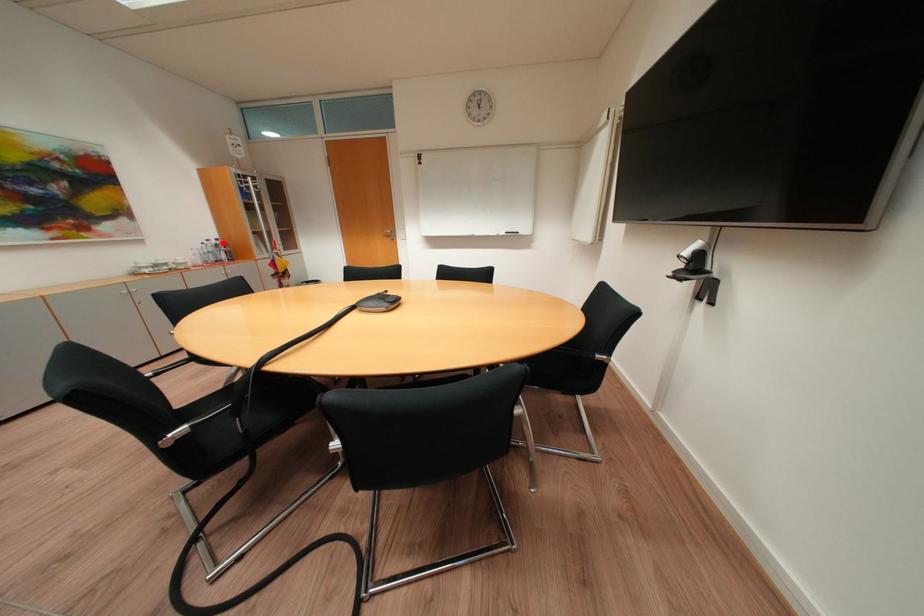
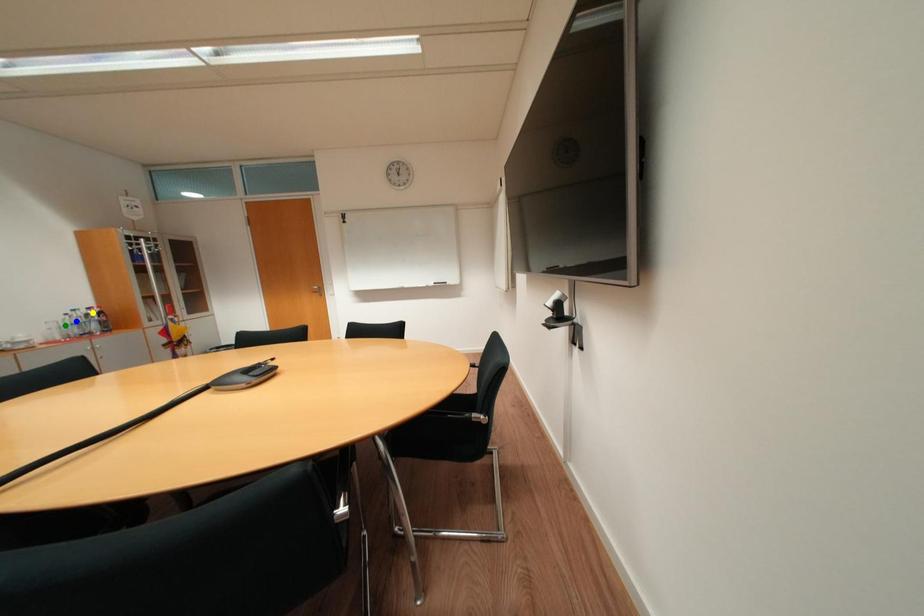
Question: I am providing you with two images of the same scene from different viewpoints. A red point is marked on the first image. You are given multiple points on the second image. Which point in image 2 is actually the same real-world point as the red point in image 1?

Choices:
 (A) yellow point
 (B) green point
 (C) blue point

Answer: (A)